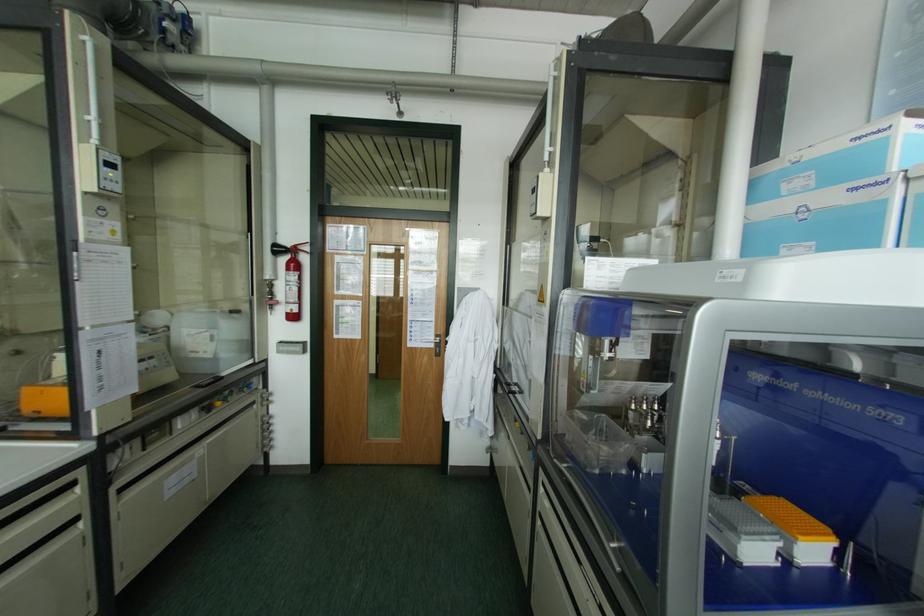
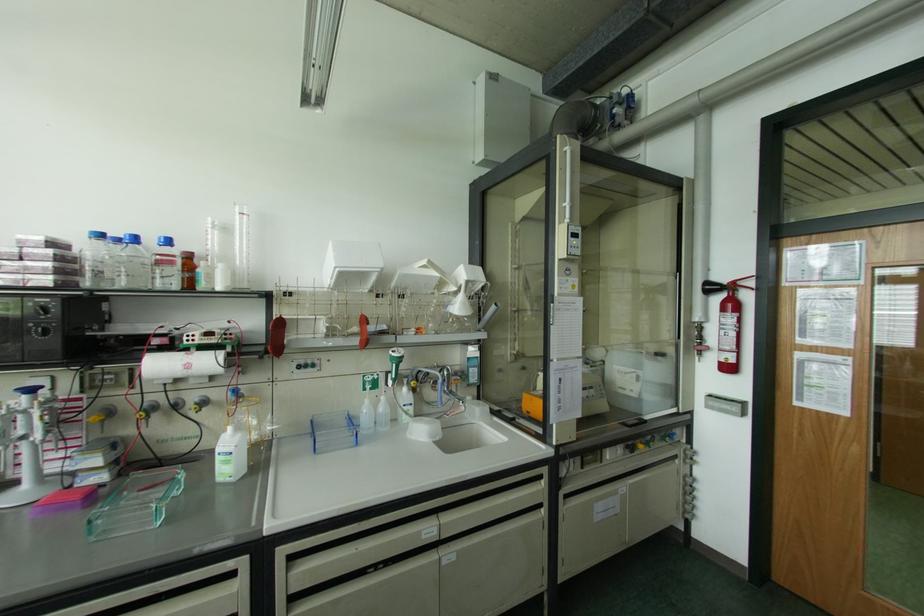
Question: Based on the continuous images, in which direction is the camera rotating? Reply with the corresponding letter.

Choices:
 (A) Left
 (B) Right
 (C) Up
 (D) Down

Answer: (A)